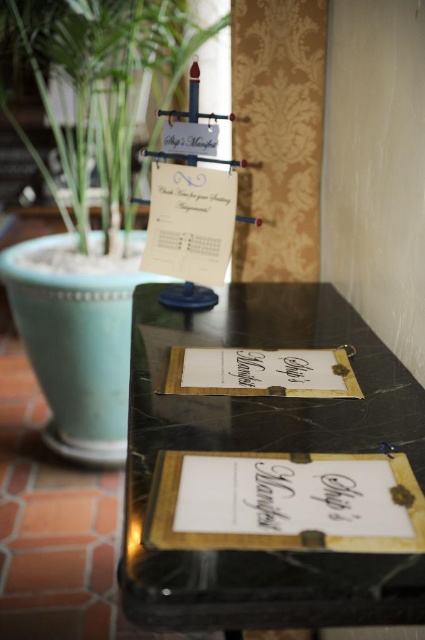
Does black marble table at center have a lesser width compared to gold paper at center?

In fact, black marble table at center might be wider than gold paper at center.

Between black marble table at center and gold paper at center, which one appears on the left side from the viewer's perspective?

From the viewer's perspective, black marble table at center appears more on the left side.

Does point (418, 435) lie in front of point (285, 355)?

Yes.

Where is `black marble table at center`? black marble table at center is located at coordinates (265, 451).

Does gold textured clipboard at center appear on the left side of gold paper at center?

Correct, you'll find gold textured clipboard at center to the left of gold paper at center.

The height and width of the screenshot is (640, 425). What do you see at coordinates (258, 372) in the screenshot?
I see `gold textured clipboard at center` at bounding box center [258, 372].

Find the location of a particular element. gold textured clipboard at center is located at coordinates coord(258,372).

Who is positioned more to the right, black marble table at center or gold textured clipboard at center?

gold textured clipboard at center

Which is in front, point (354, 406) or point (333, 380)?

Positioned in front is point (354, 406).

Where is `black marble table at center`? black marble table at center is located at coordinates (265, 451).